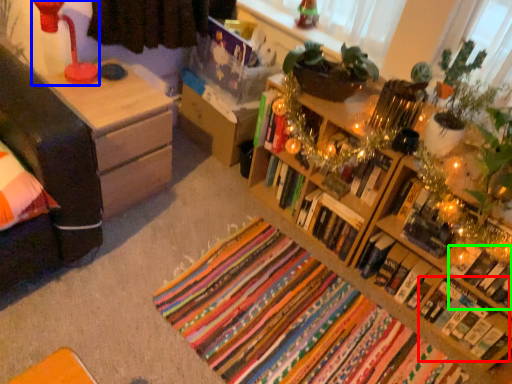
Question: Which object is positioned farthest from book (highlighted by a red box)? Select from lamp (highlighted by a blue box) and book (highlighted by a green box).

Choices:
 (A) lamp
 (B) book

Answer: (A)